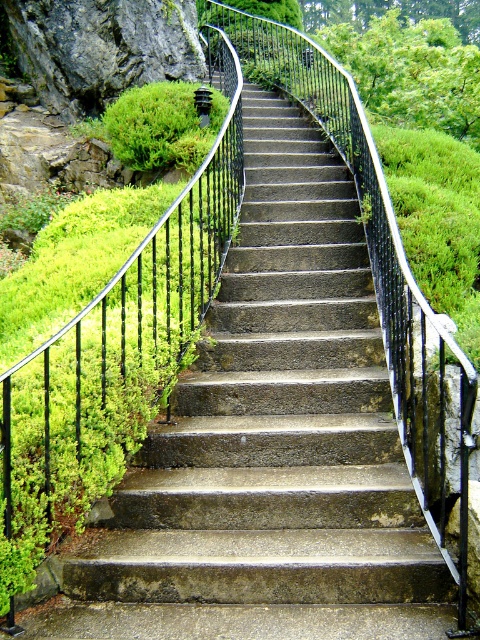
Is concrete stairs at center shorter than green mossy rock at upper left?

Incorrect, concrete stairs at center's height does not fall short of green mossy rock at upper left's.

Who is positioned more to the right, concrete stairs at center or green mossy rock at upper left?

From the viewer's perspective, concrete stairs at center appears more on the right side.

Is point (156, 531) in front of point (172, 148)?

Yes, point (156, 531) is in front of point (172, 148).

At what (x,y) coordinates should I click in order to perform the action: click on concrete stairs at center. Please return your answer as a coordinate pair (x, y). The image size is (480, 640). Looking at the image, I should click on (276, 419).